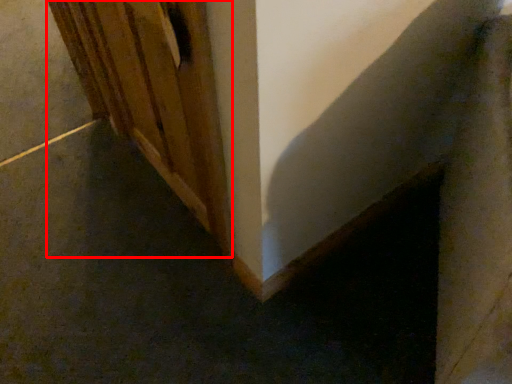
Question: Where is door (annotated by the red box) located in relation to concrete in the image?

Choices:
 (A) left
 (B) right

Answer: (B)